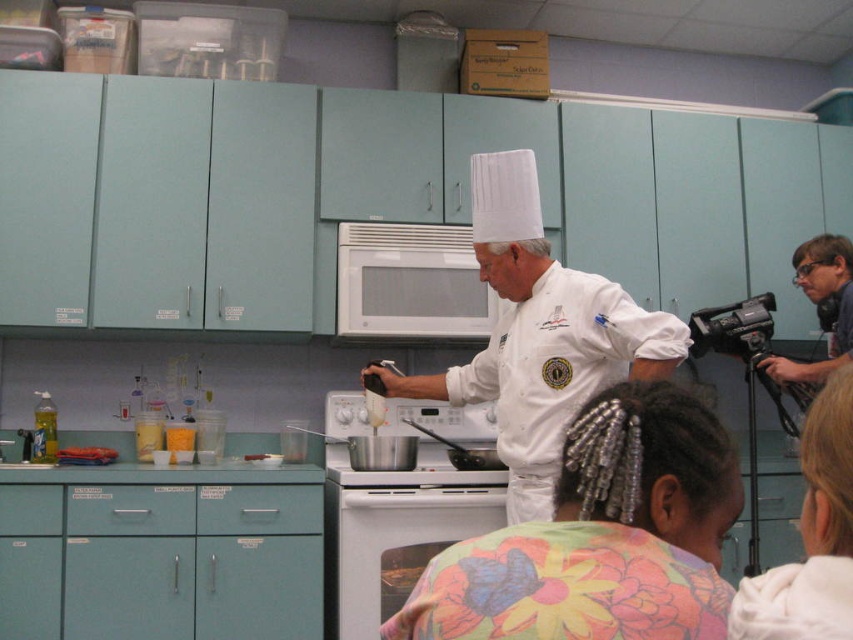
Between white matte chef hat at center and white hair at upper right, which one has less height?

white hair at upper right

What do you see at coordinates (540, 336) in the screenshot? The height and width of the screenshot is (640, 853). I see `white matte chef hat at center` at bounding box center [540, 336].

Where is `white matte chef hat at center`? white matte chef hat at center is located at coordinates (540, 336).

Is white chef hat at upper center to the left of white matte chef hat at center from the viewer's perspective?

Correct, you'll find white chef hat at upper center to the left of white matte chef hat at center.

Between point (578, 579) and point (561, 308), which one is positioned behind?

Point (561, 308)

This screenshot has width=853, height=640. What are the coordinates of `white chef hat at upper center` in the screenshot? It's located at (601, 536).

Can you confirm if white chef hat at upper center is positioned to the right of white hair at upper right?

No, white chef hat at upper center is not to the right of white hair at upper right.

Which of these two, white chef hat at upper center or white hair at upper right, stands taller?

Standing taller between the two is white chef hat at upper center.

This screenshot has height=640, width=853. What are the coordinates of `white chef hat at upper center` in the screenshot? It's located at (601, 536).